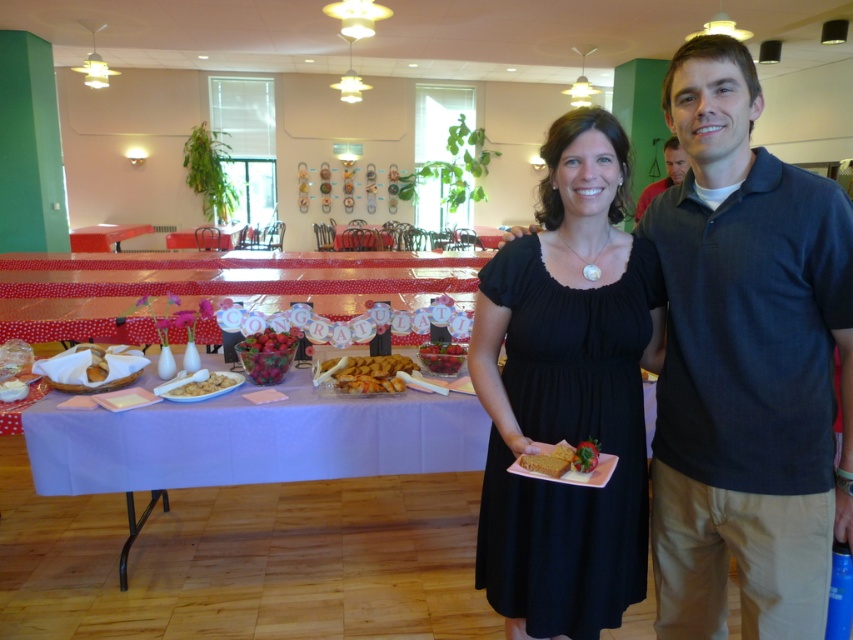
Question: Which point is farther to the camera?

Choices:
 (A) golden brown crumbly cookies at lower left
 (B) golden brown cake at center
 (C) smooth glossy strawberries at center
 (D) matte black shirt at center

Answer: (C)

Question: In this image, where is red glossy strawberries at center located relative to white paper napkin at lower left?

Choices:
 (A) above
 (B) below

Answer: (A)

Question: Which point is farther from the camera taking this photo?

Choices:
 (A) (438, 371)
 (B) (180, 384)
 (C) (741, 48)

Answer: (A)

Question: Can you confirm if dark blue polo shirt at center is positioned below matte black shirt at center?

Choices:
 (A) yes
 (B) no

Answer: (A)

Question: Which object appears closest to the camera in this image?

Choices:
 (A) golden brown crumbly cookies at lower left
 (B) red glossy strawberries at center

Answer: (A)

Question: Is smooth wooden table at center to the right of white paper napkin at lower left from the viewer's perspective?

Choices:
 (A) no
 (B) yes

Answer: (A)